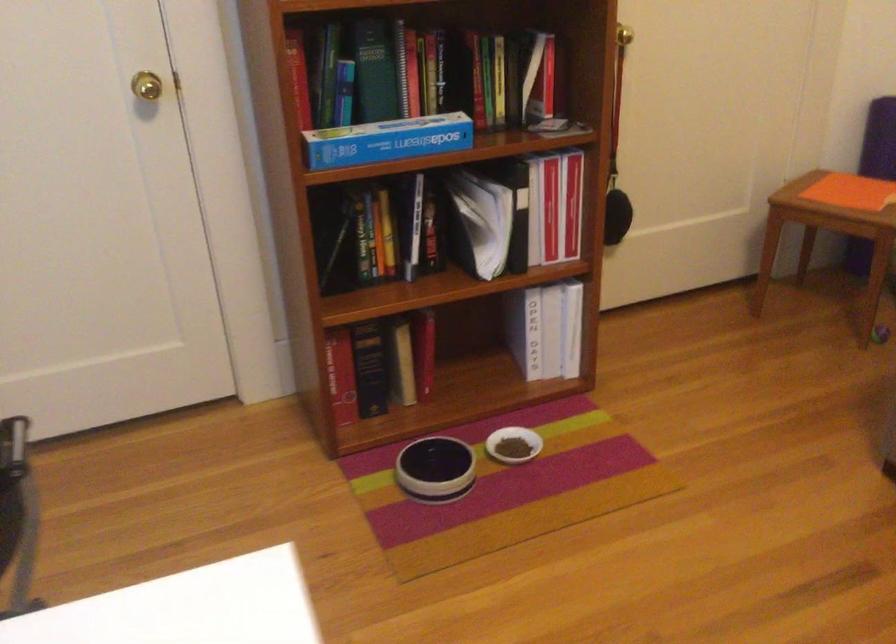
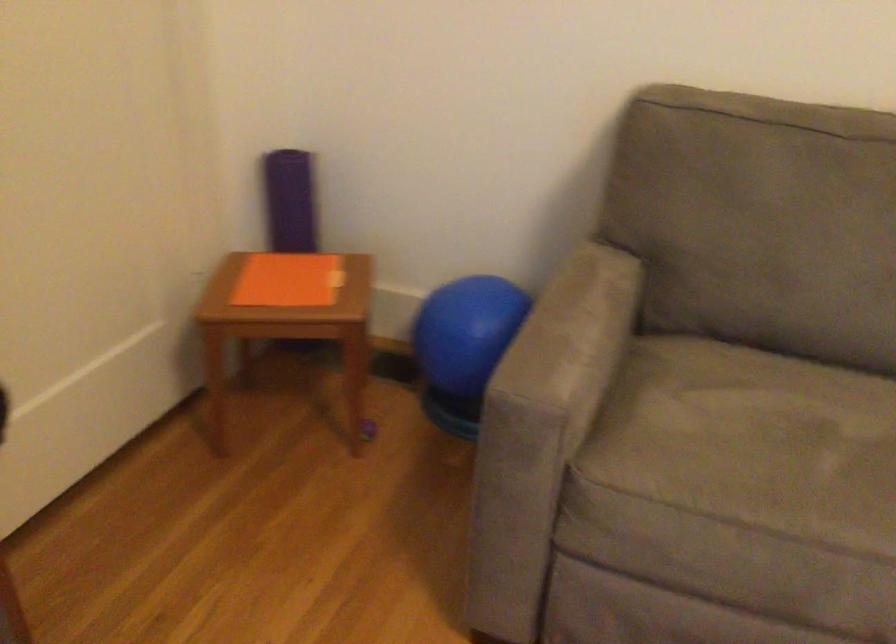
Question: How did the camera likely rotate?

Choices:
 (A) Left
 (B) Right
 (C) Up
 (D) Down

Answer: (B)